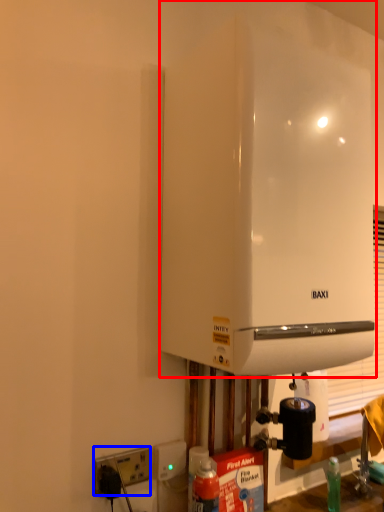
Question: Which of the following is the closest to the observer, home appliance (highlighted by a red box) or electric outlet (highlighted by a blue box)?

Choices:
 (A) home appliance
 (B) electric outlet

Answer: (A)